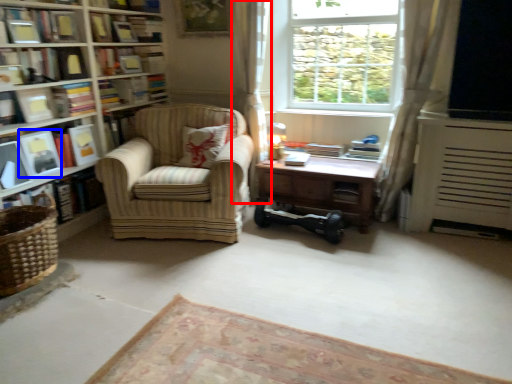
Question: Which object appears closest to the camera in this image, curtain (highlighted by a red box) or paperback book (highlighted by a blue box)?

Choices:
 (A) curtain
 (B) paperback book

Answer: (B)